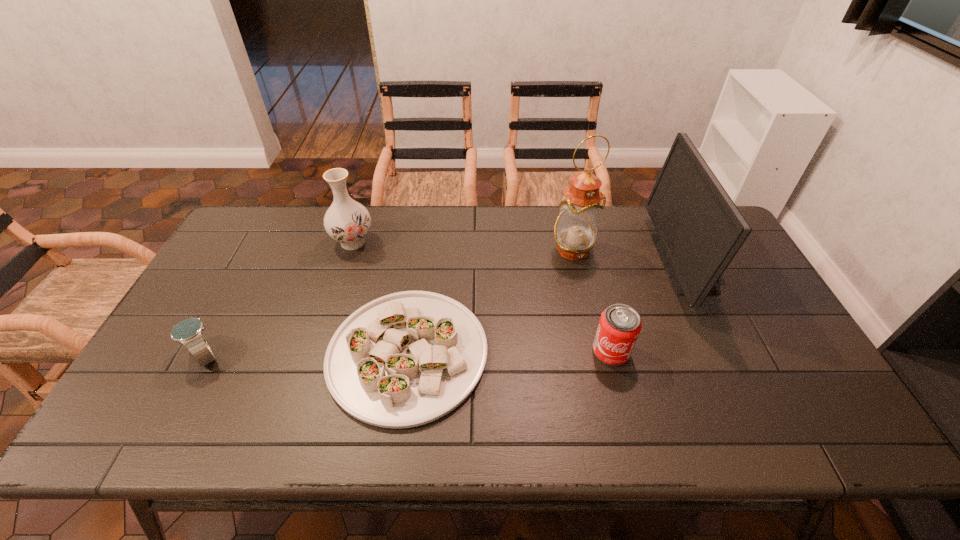
At what (x,y) coordinates should I click in order to perform the action: click on oil lamp. Please return your answer as a coordinate pair (x, y). Looking at the image, I should click on (575, 230).

Locate an element on the screen. the fifth shortest object is located at coordinates (699, 228).

Identify the location of computer monitor. (699, 228).

At what (x,y) coordinates should I click in order to perform the action: click on the fourth shortest object. Please return your answer as a coordinate pair (x, y). This screenshot has width=960, height=540. Looking at the image, I should click on (347, 221).

This screenshot has height=540, width=960. I want to click on the fourth tallest object, so click(x=619, y=327).

Where is `watch`? The width and height of the screenshot is (960, 540). watch is located at coordinates (188, 332).

At what (x,y) coordinates should I click in order to perform the action: click on the leftmost object. Please return your answer as a coordinate pair (x, y). Looking at the image, I should click on (188, 332).

The image size is (960, 540). What are the coordinates of `platter` in the screenshot? It's located at (406, 359).

Find the location of a particular element. blank space located on the front of the tallest object is located at coordinates (599, 369).

Locate an element on the screen. The width and height of the screenshot is (960, 540). free spot located 0.130m on the screen side of the computer monitor is located at coordinates (619, 263).